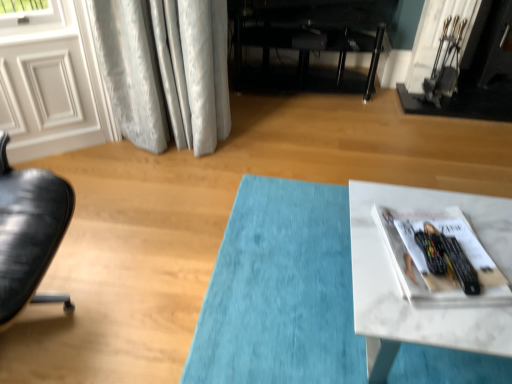
Question: Could you tell me if white marble table at lower right is turned towards white glossy magazine at lower right?

Choices:
 (A) yes
 (B) no

Answer: (B)

Question: Can you confirm if white marble table at lower right is wider than white glossy magazine at lower right?

Choices:
 (A) no
 (B) yes

Answer: (B)

Question: Is white marble table at lower right thinner than white glossy magazine at lower right?

Choices:
 (A) yes
 (B) no

Answer: (B)

Question: From the image's perspective, would you say white marble table at lower right is shown under white glossy magazine at lower right?

Choices:
 (A) yes
 (B) no

Answer: (A)

Question: Is white marble table at lower right looking in the opposite direction of white glossy magazine at lower right?

Choices:
 (A) no
 (B) yes

Answer: (A)

Question: Is white glossy magazine at lower right taller or shorter than white glossy door at upper left?

Choices:
 (A) tall
 (B) short

Answer: (B)

Question: Is white glossy magazine at lower right bigger or smaller than white glossy door at upper left?

Choices:
 (A) big
 (B) small

Answer: (B)

Question: Considering the relative positions of white glossy magazine at lower right and white glossy door at upper left in the image provided, is white glossy magazine at lower right to the left or to the right of white glossy door at upper left?

Choices:
 (A) left
 (B) right

Answer: (B)

Question: Which is correct: white glossy magazine at lower right is inside white glossy door at upper left, or outside of it?

Choices:
 (A) outside
 (B) inside

Answer: (A)

Question: From the image's perspective, is black glossy entertainment center at center located above or below white marble table at lower right?

Choices:
 (A) below
 (B) above

Answer: (B)

Question: Based on their sizes in the image, would you say black glossy entertainment center at center is bigger or smaller than white marble table at lower right?

Choices:
 (A) big
 (B) small

Answer: (A)

Question: From a real-world perspective, relative to white marble table at lower right, is black glossy entertainment center at center vertically above or below?

Choices:
 (A) below
 (B) above

Answer: (B)

Question: Which is correct: black glossy entertainment center at center is inside white marble table at lower right, or outside of it?

Choices:
 (A) outside
 (B) inside

Answer: (A)

Question: Does point (104, 135) appear closer or farther from the camera than point (509, 51)?

Choices:
 (A) farther
 (B) closer

Answer: (B)

Question: Considering their positions, is white glossy door at upper left located in front of or behind black metal fireplace at upper right?

Choices:
 (A) behind
 (B) front

Answer: (B)